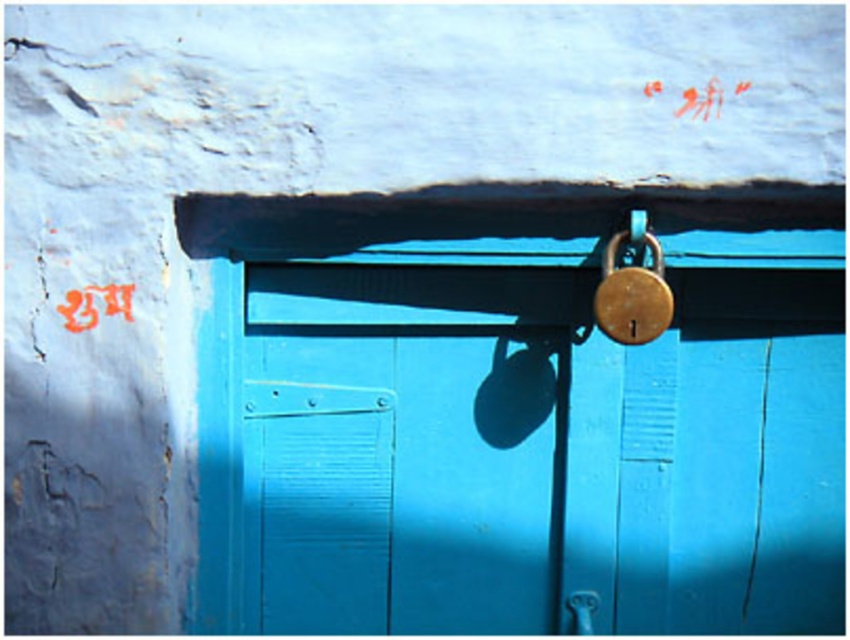
Can you confirm if blue matte padlock at center is thinner than gold metallic padlock at upper center?

In fact, blue matte padlock at center might be wider than gold metallic padlock at upper center.

Can you confirm if blue matte padlock at center is shorter than gold metallic padlock at upper center?

No.

Which is in front, point (740, 474) or point (650, 248)?

Point (650, 248) is more forward.

I want to click on blue matte padlock at center, so click(x=527, y=442).

Can you confirm if blue matte padlock at center is positioned to the left of polished silver door handle at lower center?

Indeed, blue matte padlock at center is positioned on the left side of polished silver door handle at lower center.

In order to click on blue matte padlock at center in this screenshot , I will do `click(527, 442)`.

Does point (81, 296) come closer to viewer compared to point (592, 620)?

Yes, point (81, 296) is in front of point (592, 620).

Can you confirm if brushed metal lock at center is smaller than polished silver door handle at lower center?

No.

Who is more distant from viewer, (106,300) or (571,602)?

Point (571,602)

This screenshot has height=640, width=850. Find the location of `brushed metal lock at center`. brushed metal lock at center is located at coordinates (95, 305).